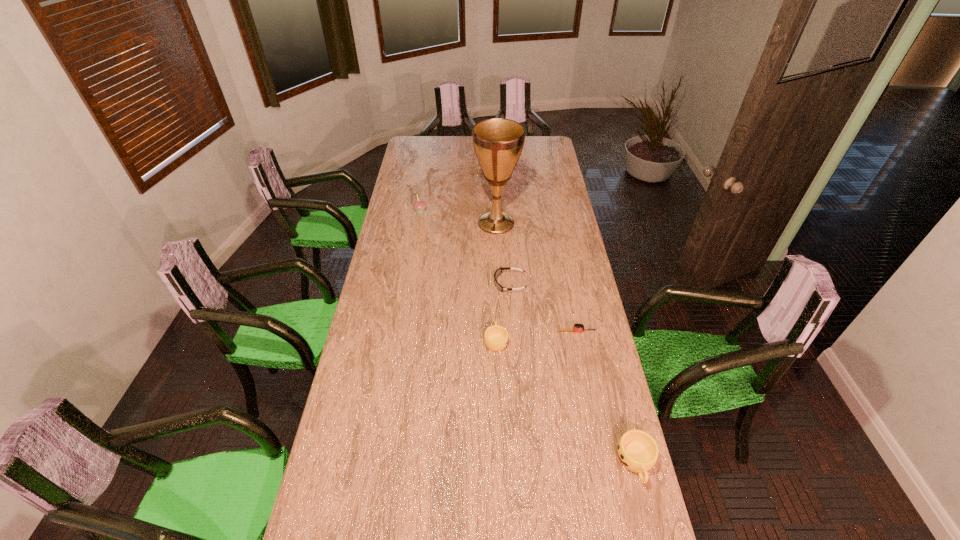
Locate an element on the screen. The height and width of the screenshot is (540, 960). vacant area that lies between the trophy cup and the second shortest object is located at coordinates (503, 253).

At what (x,y) coordinates should I click in order to perform the action: click on free space that is in between the tallest object and the fifth tallest object. Please return your answer as a coordinate pair (x, y). The image size is (960, 540). Looking at the image, I should click on (503, 253).

Where is `free space between the tallest object and the right cup`? The image size is (960, 540). free space between the tallest object and the right cup is located at coordinates (565, 343).

I want to click on free space between the cupcake and the farther cup, so click(x=458, y=276).

Where is `free space between the trophy cup and the fifth shortest object`? free space between the trophy cup and the fifth shortest object is located at coordinates (458, 217).

Identify the location of the second closest object relative to the tallest object. The height and width of the screenshot is (540, 960). (499, 270).

The image size is (960, 540). What are the coordinates of `object that is the third closest to the trophy cup` in the screenshot? It's located at (496, 337).

Identify the location of vacant space that satisfies the following two spatial constraints: 1. on the front side of the trophy cup; 2. on the right side of the nearer cup. The image size is (960, 540). (506, 462).

Where is `vacant region that satisfies the following two spatial constraints: 1. on the front and sides of the fourth nearest object; 2. on the left side of the tape measure`? vacant region that satisfies the following two spatial constraints: 1. on the front and sides of the fourth nearest object; 2. on the left side of the tape measure is located at coordinates (513, 332).

Identify the location of free location that satisfies the following two spatial constraints: 1. on the front and sides of the goggles; 2. on the left side of the tape measure. (513, 332).